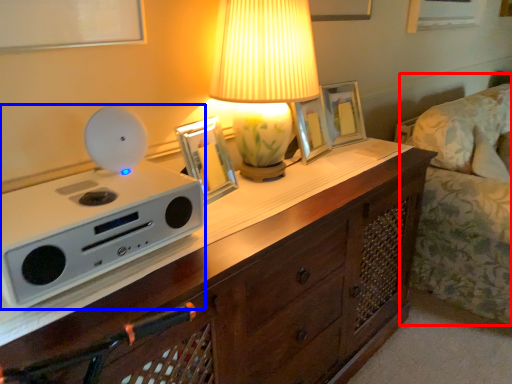
Question: Which of the following is the closest to the observer, couch (highlighted by a red box) or appliance (highlighted by a blue box)?

Choices:
 (A) couch
 (B) appliance

Answer: (B)